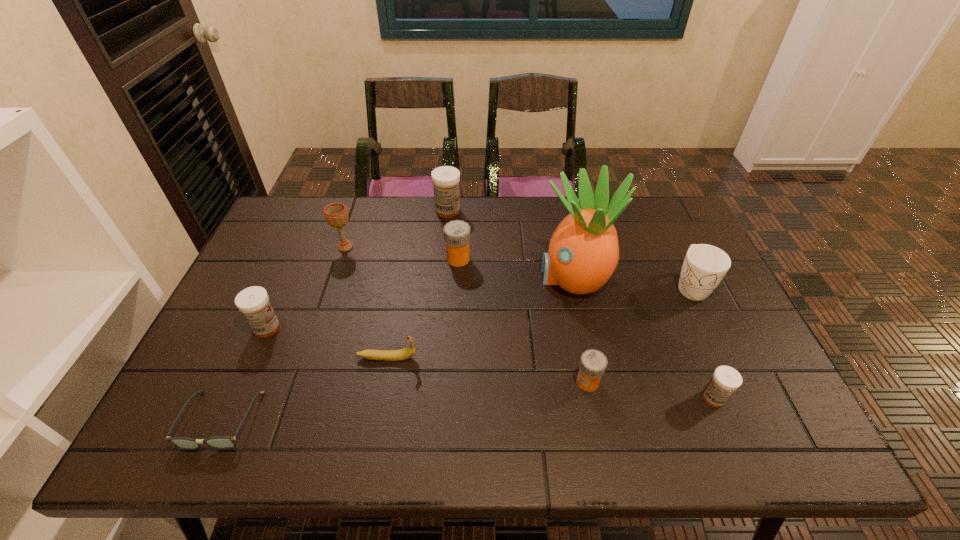
Identify the location of free location at the far edge. The height and width of the screenshot is (540, 960). (368, 196).

Where is `free space at the near edge of the desktop`? The height and width of the screenshot is (540, 960). free space at the near edge of the desktop is located at coordinates (652, 427).

In order to click on free space at the left edge of the desktop in this screenshot , I will do `click(291, 261)`.

Identify the location of vacant space at the right edge. (725, 359).

This screenshot has height=540, width=960. Identify the location of vacant space at the far right corner of the desktop. (646, 200).

The image size is (960, 540). I want to click on vacant space at the near right corner of the desktop, so click(794, 427).

At what (x,y) coordinates should I click in order to perform the action: click on free point between the second biggest white medicine and the eighth object from right to left. Please return your answer as a coordinate pair (x, y). The width and height of the screenshot is (960, 540). Looking at the image, I should click on (306, 287).

This screenshot has width=960, height=540. Find the location of `free space between the spectacles and the second white medicine from left to right`. free space between the spectacles and the second white medicine from left to right is located at coordinates (334, 315).

Identify the location of unoccupied area between the mug and the beige chalice. The width and height of the screenshot is (960, 540). (x=518, y=267).

Identify the location of vacant space that's between the eighth object from right to left and the second nearest white medicine. (306, 287).